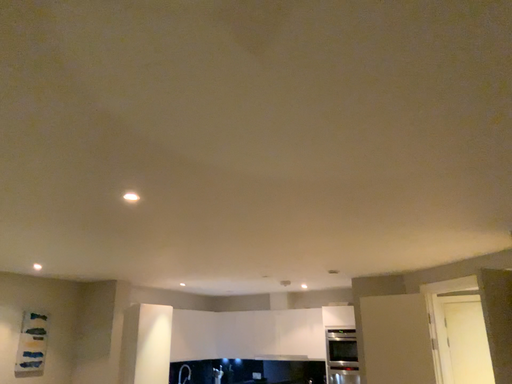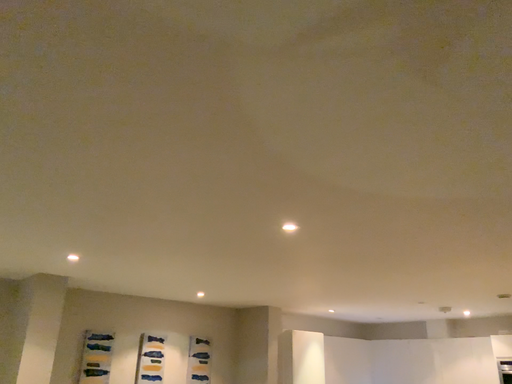
Question: How did the camera likely rotate when shooting the video?

Choices:
 (A) rotated right
 (B) rotated left

Answer: (B)